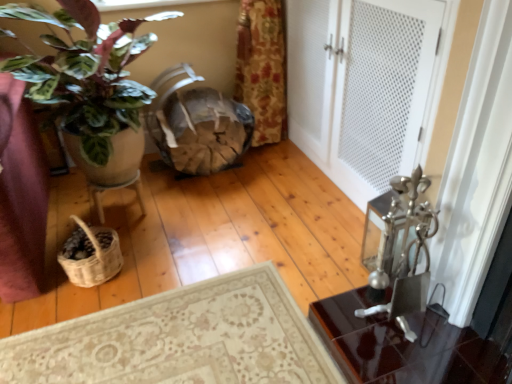
Question: In the image, is white textured door at center positioned in front of or behind wooden textured basket at center?

Choices:
 (A) behind
 (B) front

Answer: (B)

Question: Visually, is white textured door at center positioned to the left or to the right of wooden textured basket at center?

Choices:
 (A) right
 (B) left

Answer: (A)

Question: Which of these objects is positioned closest to the matte brown pot at left?

Choices:
 (A) wooden textured basket at center
 (B) white textured door at center
 (C) woven natural fiber basket at lower left

Answer: (C)

Question: Which object is the closest to the woven natural fiber basket at lower left?

Choices:
 (A) white textured door at center
 (B) matte brown pot at left
 (C) wooden textured basket at center

Answer: (B)